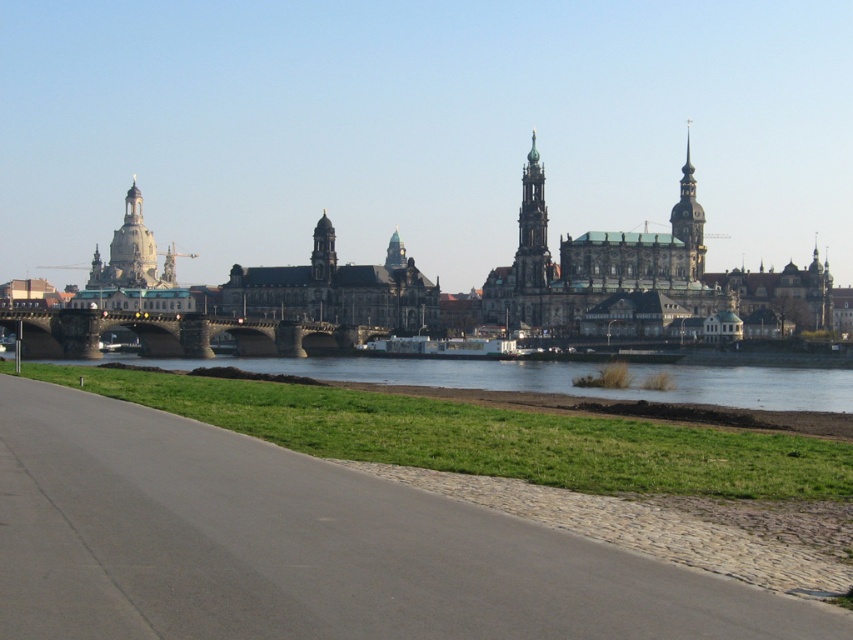
Question: Estimate the real-world distances between objects in this image. Which object is farther from the golden stone spire at upper right?

Choices:
 (A) golden stone tower at center
 (B) smooth gold spire at center right
 (C) green grassy bank at lower center

Answer: (C)

Question: Which point is closer to the camera?

Choices:
 (A) click(x=839, y=372)
 (B) click(x=502, y=548)
 (C) click(x=136, y=220)

Answer: (B)

Question: Can you confirm if green grassy bank at lower center is positioned to the left of smooth gold spire at center right?

Choices:
 (A) no
 (B) yes

Answer: (B)

Question: Is gray asphalt path at lower center further to the viewer compared to golden stone tower at center?

Choices:
 (A) no
 (B) yes

Answer: (A)

Question: Does gray asphalt path at lower center have a larger size compared to smooth gold spire at center right?

Choices:
 (A) yes
 (B) no

Answer: (A)

Question: Which point is farther from the camera taking this photo?

Choices:
 (A) (352, 541)
 (B) (328, 234)

Answer: (B)